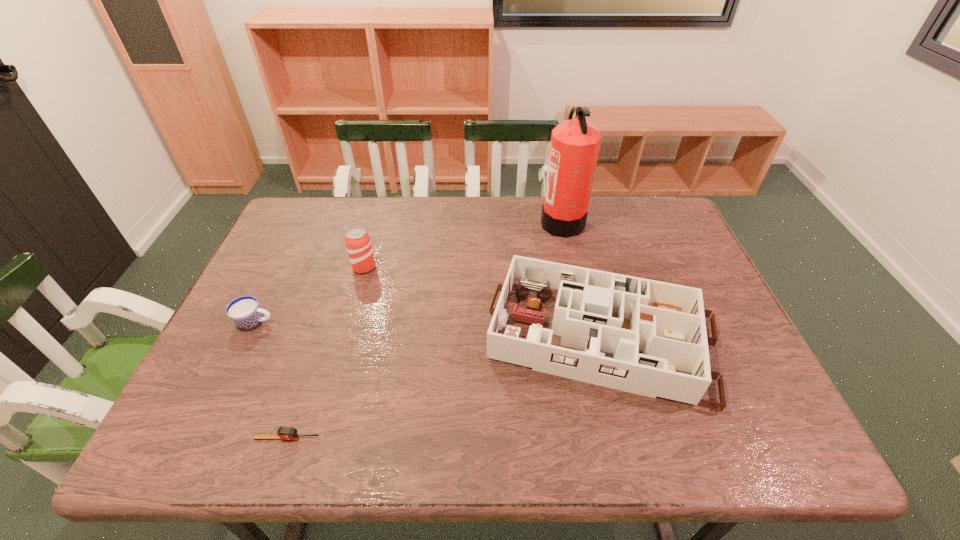
I want to click on free space at the far edge, so click(x=360, y=221).

Find the location of a particular element. This screenshot has width=960, height=540. free space at the near edge of the desktop is located at coordinates (554, 439).

Locate an element on the screen. This screenshot has height=540, width=960. free region at the left edge of the desktop is located at coordinates (253, 345).

This screenshot has height=540, width=960. I want to click on vacant space at the right edge of the desktop, so click(x=687, y=278).

At what (x,y) coordinates should I click in order to perform the action: click on blank space at the far left corner of the desktop. Please return your answer as a coordinate pair (x, y). This screenshot has width=960, height=540. Looking at the image, I should click on (314, 205).

Locate an element on the screen. Image resolution: width=960 pixels, height=540 pixels. free space at the near left corner of the desktop is located at coordinates pos(183,426).

In the image, there is a desktop. Where is `free space at the far right corner`? free space at the far right corner is located at coordinates (684, 235).

This screenshot has height=540, width=960. In the image, there is a desktop. In order to click on free region at the near right corner in this screenshot , I will do `click(763, 429)`.

I want to click on free spot between the cup and the third tallest object, so click(428, 330).

At what (x,y) coordinates should I click in order to perform the action: click on free space between the fire extinguisher and the fourth nearest object. Please return your answer as a coordinate pair (x, y). The width and height of the screenshot is (960, 540). Looking at the image, I should click on (463, 244).